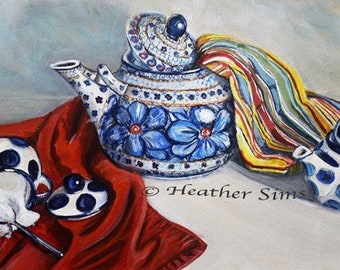
I want to click on tea pot, so (179, 118), (333, 172).